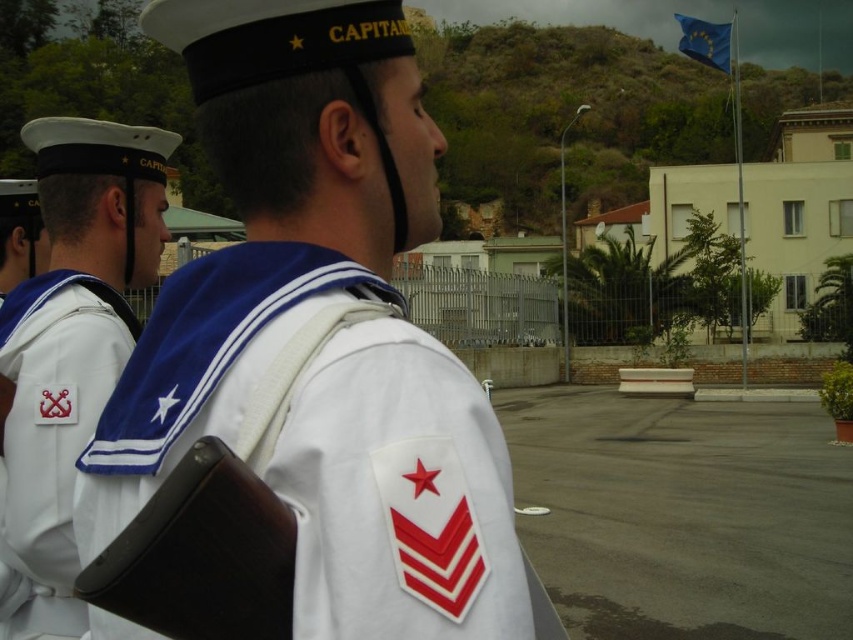
Question: Does white matte uniform at center have a greater width compared to white fabric patch at left?

Choices:
 (A) yes
 (B) no

Answer: (A)

Question: Which object appears closest to the camera in this image?

Choices:
 (A) blue fabric flag at upper right
 (B) white fabric patch at left
 (C) white matte uniform at center

Answer: (C)

Question: Which point appears closest to the camera in this image?

Choices:
 (A) (44, 280)
 (B) (117, 550)
 (C) (723, 52)

Answer: (B)

Question: Is white matte uniform at center bigger than white fabric patch at left?

Choices:
 (A) no
 (B) yes

Answer: (B)

Question: Among these objects, which one is farthest from the camera?

Choices:
 (A) white fabric patch at left
 (B) white matte uniform at center
 (C) blue fabric flag at upper right

Answer: (C)

Question: Is white fabric patch at left wider than blue fabric flag at upper right?

Choices:
 (A) yes
 (B) no

Answer: (B)